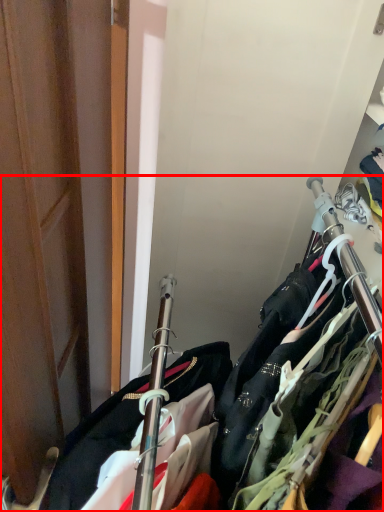
Question: From the image's perspective, considering the relative positions of closet (annotated by the red box) and door in the image provided, where is closet (annotated by the red box) located with respect to the staircase?

Choices:
 (A) below
 (B) above

Answer: (A)